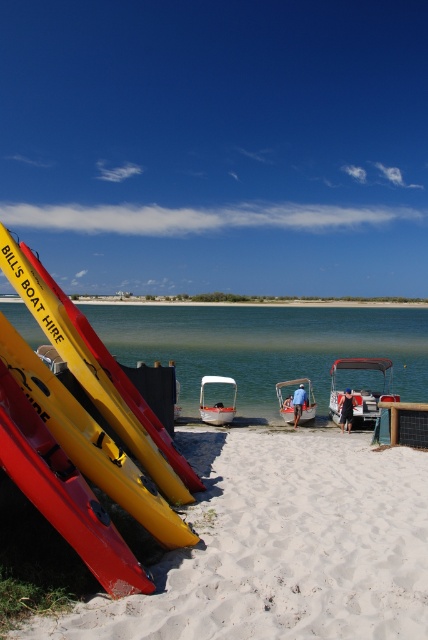
Question: Which point is closer to the camera?

Choices:
 (A) green smooth water at center
 (B) white matte boat at center
 (C) matte yellow kayak at left
 (D) white plastic boat at center

Answer: (C)

Question: Which point is closer to the camera taking this photo?

Choices:
 (A) (125, 499)
 (B) (360, 360)
 (C) (155, 356)

Answer: (A)

Question: Where is matte yellow kayak at left located in relation to green smooth water at center in the image?

Choices:
 (A) right
 (B) left

Answer: (A)

Question: Among these points, which one is nearest to the camera?

Choices:
 (A) (392, 397)
 (B) (290, 422)
 (C) (244, 556)

Answer: (C)

Question: Is white sandy beach at lower left positioned at the back of green smooth water at center?

Choices:
 (A) yes
 (B) no

Answer: (B)

Question: Can you confirm if white sandy beach at lower left is bigger than green smooth water at center?

Choices:
 (A) yes
 (B) no

Answer: (B)